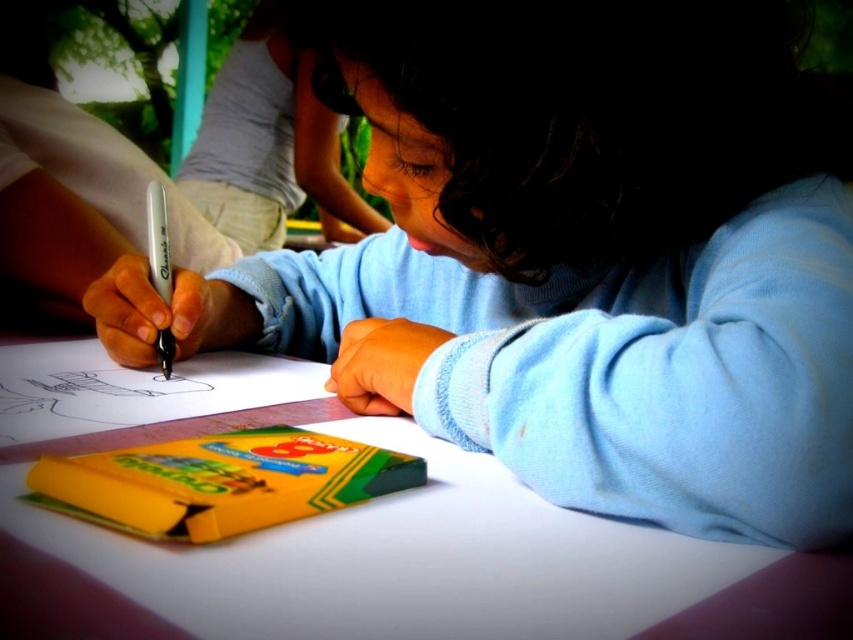
Question: Which object appears farthest from the camera in this image?

Choices:
 (A) white paper at center
 (B) yellow cardboard coloring book at center

Answer: (B)

Question: Estimate the real-world distances between objects in this image. Which object is farther from the white paper at center?

Choices:
 (A) white matte pen at center
 (B) yellow cardboard coloring book at center

Answer: (A)

Question: Estimate the real-world distances between objects in this image. Which object is closer to the white paper at center?

Choices:
 (A) yellow cardboard coloring book at center
 (B) white matte pen at center

Answer: (A)

Question: Does white paper at center appear over yellow cardboard coloring book at center?

Choices:
 (A) no
 (B) yes

Answer: (A)

Question: Is white paper at center wider than white matte pen at center?

Choices:
 (A) no
 (B) yes

Answer: (B)

Question: Can you confirm if white paper at center is positioned above yellow cardboard coloring book at center?

Choices:
 (A) no
 (B) yes

Answer: (A)